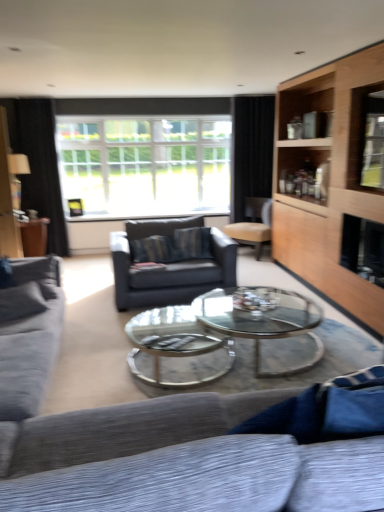
Question: Is textured gray couch at left, the 2th studio couch viewed from the right, oriented towards textured gray couch at lower center, which is the first studio couch in right-to-left order?

Choices:
 (A) yes
 (B) no

Answer: (B)

Question: Is textured gray couch at left, the 2th studio couch viewed from the right, at the right side of textured gray couch at lower center, which is the second studio couch in left-to-right order?

Choices:
 (A) no
 (B) yes

Answer: (A)

Question: Is textured gray couch at left, the 2th studio couch viewed from the right, not within textured gray couch at lower center, which is the first studio couch in right-to-left order?

Choices:
 (A) no
 (B) yes

Answer: (B)

Question: Is textured gray couch at left, the 2th studio couch viewed from the right, positioned with its back to textured gray couch at lower center, which is the second studio couch in left-to-right order?

Choices:
 (A) yes
 (B) no

Answer: (B)

Question: From a real-world perspective, is textured gray couch at left, the 2th studio couch viewed from the right, located beneath textured gray couch at lower center, which is the second studio couch in left-to-right order?

Choices:
 (A) yes
 (B) no

Answer: (B)

Question: Does textured gray couch at left, arranged as the 1th studio couch when viewed from the left, appear on the left side of textured gray couch at lower center, which is the first studio couch in right-to-left order?

Choices:
 (A) yes
 (B) no

Answer: (A)

Question: Does textured gray couch at lower center, which is the first studio couch in right-to-left order, have a lesser height compared to dark gray fabric swivel chair at center?

Choices:
 (A) yes
 (B) no

Answer: (A)

Question: Is textured gray couch at lower center, which is the first studio couch in right-to-left order, oriented towards dark gray fabric swivel chair at center?

Choices:
 (A) yes
 (B) no

Answer: (A)

Question: Is textured gray couch at lower center, which is the second studio couch in left-to-right order, at the right side of dark gray fabric swivel chair at center?

Choices:
 (A) no
 (B) yes

Answer: (B)

Question: Is textured gray couch at lower center, which is the first studio couch in right-to-left order, not close to dark gray fabric swivel chair at center?

Choices:
 (A) yes
 (B) no

Answer: (A)

Question: Is textured gray couch at lower center, which is the first studio couch in right-to-left order, smaller than dark gray fabric swivel chair at center?

Choices:
 (A) yes
 (B) no

Answer: (B)

Question: Is textured gray couch at lower center, which is the second studio couch in left-to-right order, at the left side of dark gray fabric swivel chair at center?

Choices:
 (A) yes
 (B) no

Answer: (B)

Question: Considering the relative sizes of beige leather chair at center and textured gray couch at left, the 2th studio couch viewed from the right, in the image provided, is beige leather chair at center bigger than textured gray couch at left, the 2th studio couch viewed from the right,?

Choices:
 (A) yes
 (B) no

Answer: (B)